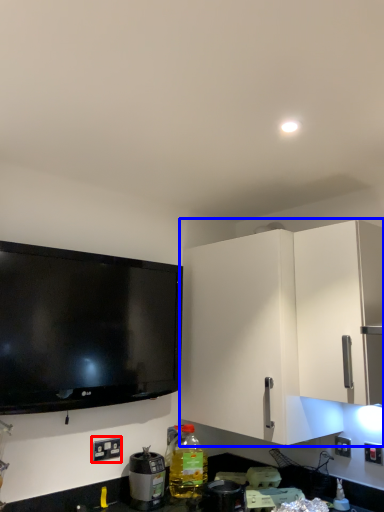
Question: Among these objects, which one is farthest to the camera, electric outlet (highlighted by a red box) or cabinetry (highlighted by a blue box)?

Choices:
 (A) electric outlet
 (B) cabinetry

Answer: (A)